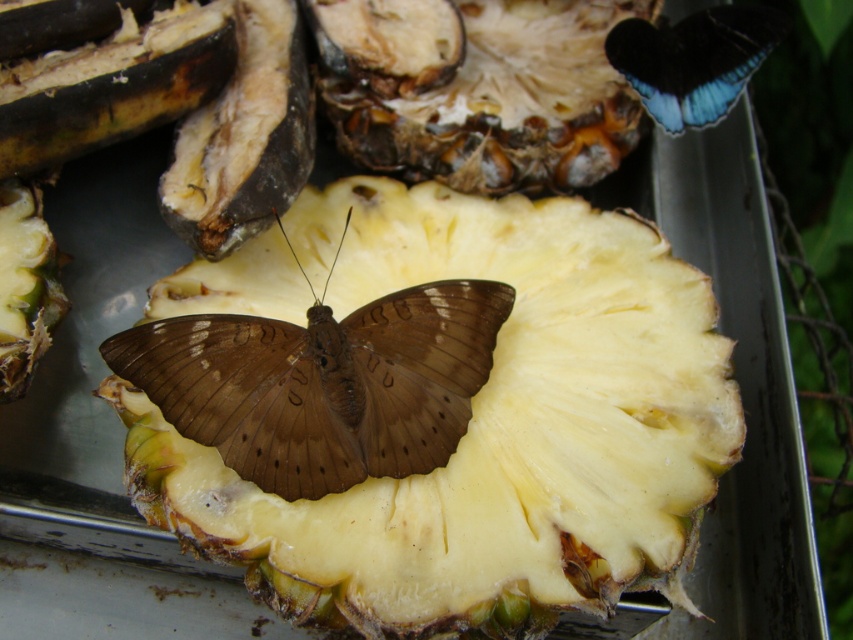
Question: Can you confirm if brown matte butterfly at center is wider than blue glossy butterfly at upper right?

Choices:
 (A) no
 (B) yes

Answer: (B)

Question: Which object appears farthest from the camera in this image?

Choices:
 (A) blue glossy butterfly at upper right
 (B) yellowish matte pineapple at center

Answer: (A)

Question: Is brown matte butterfly at center positioned behind blue glossy butterfly at upper right?

Choices:
 (A) no
 (B) yes

Answer: (A)

Question: Which point is farther from the camera taking this photo?

Choices:
 (A) coord(451,308)
 (B) coord(395,605)

Answer: (A)

Question: Which point appears closest to the camera in this image?

Choices:
 (A) (700, 35)
 (B) (323, 308)
 (C) (589, 314)

Answer: (B)

Question: Does brown matte butterfly at center appear over blue glossy butterfly at upper right?

Choices:
 (A) yes
 (B) no

Answer: (B)